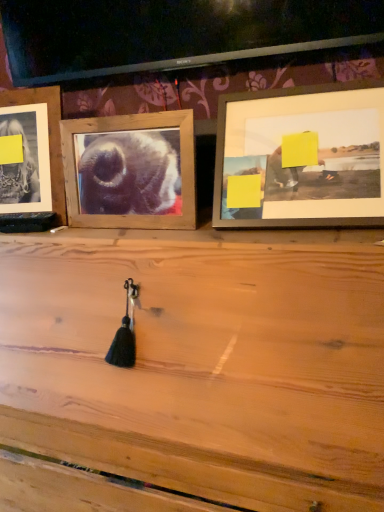
Question: From the image's perspective, would you say wooden picture frame at upper right, which appears as the first picture frame when viewed from the right, is shown under wooden frame at left, the third picture frame in the right-to-left sequence?

Choices:
 (A) no
 (B) yes

Answer: (B)

Question: From a real-world perspective, is wooden picture frame at upper right, the third picture frame when ordered from left to right, beneath wooden frame at left, the 1th picture frame in the left-to-right sequence?

Choices:
 (A) yes
 (B) no

Answer: (A)

Question: Is wooden picture frame at upper right, which appears as the first picture frame when viewed from the right, next to wooden frame at left, the 1th picture frame in the left-to-right sequence, and touching it?

Choices:
 (A) yes
 (B) no

Answer: (B)

Question: Is wooden picture frame at upper right, the third picture frame when ordered from left to right, positioned with its back to wooden frame at left, the 1th picture frame in the left-to-right sequence?

Choices:
 (A) no
 (B) yes

Answer: (A)

Question: Could you tell me if wooden picture frame at upper right, which appears as the first picture frame when viewed from the right, is facing wooden frame at left, the 1th picture frame in the left-to-right sequence?

Choices:
 (A) no
 (B) yes

Answer: (A)

Question: Is wooden picture frame at upper right, which appears as the first picture frame when viewed from the right, located outside wooden frame at left, the third picture frame in the right-to-left sequence?

Choices:
 (A) yes
 (B) no

Answer: (A)

Question: Is wooden frame at center, the second picture frame from the left, to the left of wooden frame at left, the third picture frame in the right-to-left sequence, from the viewer's perspective?

Choices:
 (A) yes
 (B) no

Answer: (B)

Question: Can you confirm if wooden frame at center, the second picture frame from the left, is smaller than wooden frame at left, the 1th picture frame in the left-to-right sequence?

Choices:
 (A) yes
 (B) no

Answer: (A)

Question: Considering the relative sizes of wooden frame at center, placed as the 2th picture frame when sorted from right to left, and wooden frame at left, the third picture frame in the right-to-left sequence, in the image provided, is wooden frame at center, placed as the 2th picture frame when sorted from right to left, bigger than wooden frame at left, the third picture frame in the right-to-left sequence,?

Choices:
 (A) no
 (B) yes

Answer: (A)

Question: Considering the relative sizes of wooden frame at center, the second picture frame from the left, and wooden frame at left, the 1th picture frame in the left-to-right sequence, in the image provided, is wooden frame at center, the second picture frame from the left, taller than wooden frame at left, the 1th picture frame in the left-to-right sequence,?

Choices:
 (A) no
 (B) yes

Answer: (A)

Question: Is wooden frame at center, the second picture frame from the left, further to camera compared to wooden frame at left, the 1th picture frame in the left-to-right sequence?

Choices:
 (A) yes
 (B) no

Answer: (B)

Question: Is wooden frame at left, the third picture frame in the right-to-left sequence, at the back of wooden frame at center, placed as the 2th picture frame when sorted from right to left?

Choices:
 (A) no
 (B) yes

Answer: (A)

Question: Is wooden picture frame at upper right, the third picture frame when ordered from left to right, not inside wooden frame at center, placed as the 2th picture frame when sorted from right to left?

Choices:
 (A) no
 (B) yes

Answer: (B)